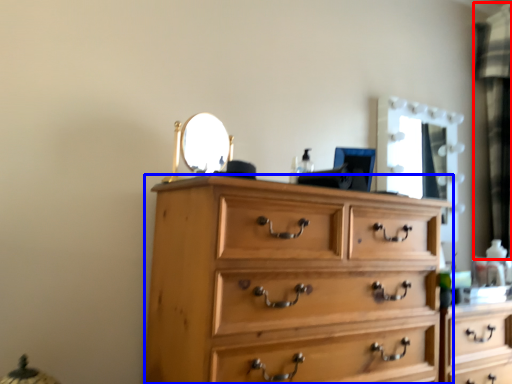
Question: Among these objects, which one is nearest to the camera, curtain (highlighted by a red box) or chest of drawers (highlighted by a blue box)?

Choices:
 (A) curtain
 (B) chest of drawers

Answer: (B)